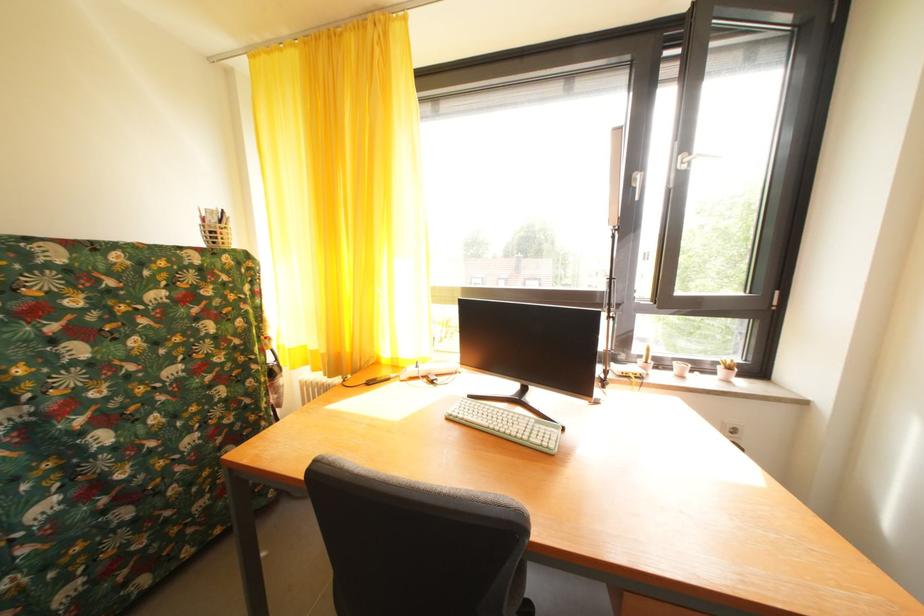
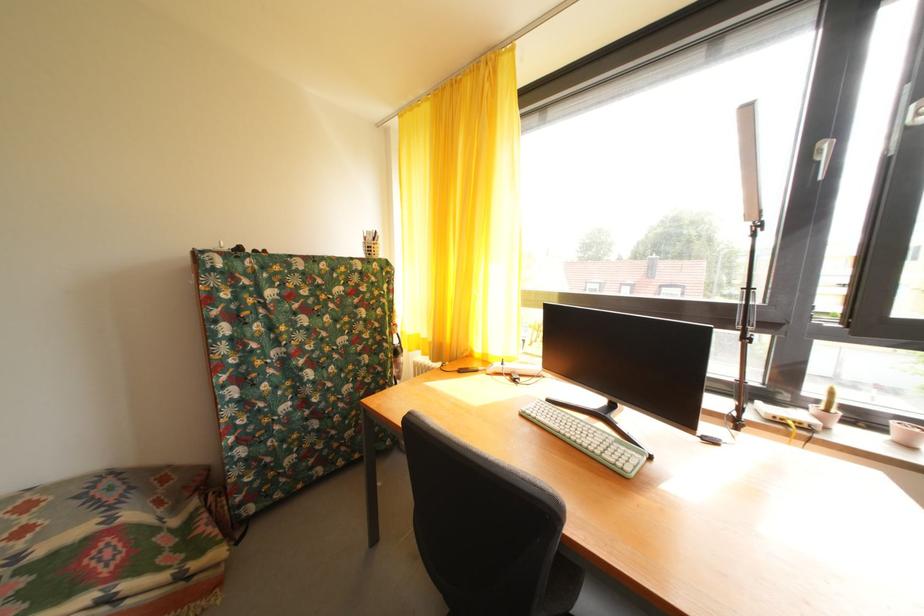
Locate, in the second image, the point that corresponds to point (655, 368) in the first image.

(836, 416)